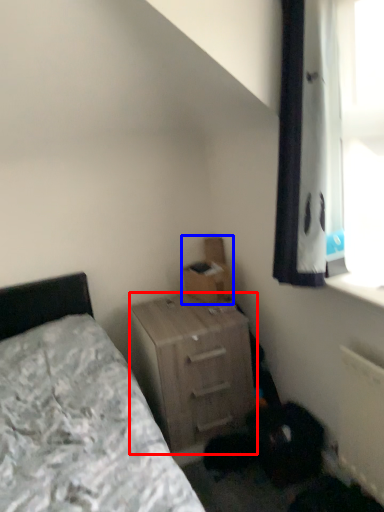
Question: Which object is further to the camera taking this photo, nightstand (highlighted by a red box) or cardboard box (highlighted by a blue box)?

Choices:
 (A) nightstand
 (B) cardboard box

Answer: (B)